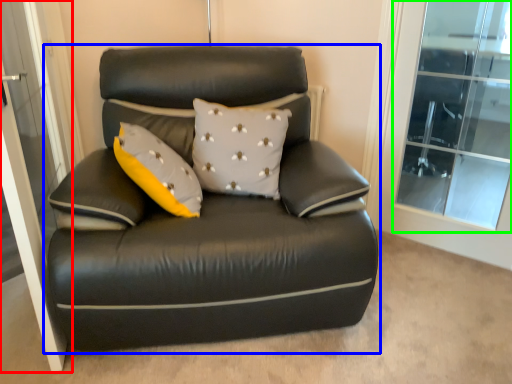
Question: Estimate the real-world distances between objects in this image. Which object is farther from screen door (highlighted by a red box), studio couch (highlighted by a blue box) or window (highlighted by a green box)?

Choices:
 (A) studio couch
 (B) window

Answer: (B)